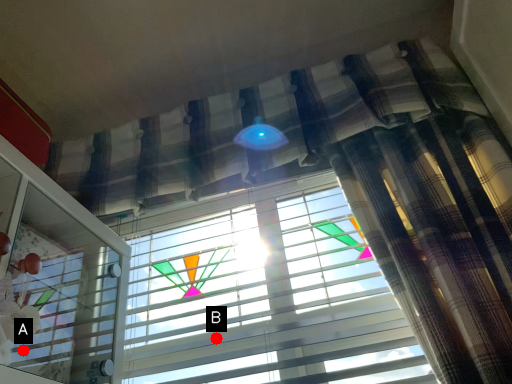
Question: Two points are circled on the image, labeled by A and B beside each circle. Which point appears farthest from the camera in this image?

Choices:
 (A) A is further
 (B) B is further

Answer: (B)